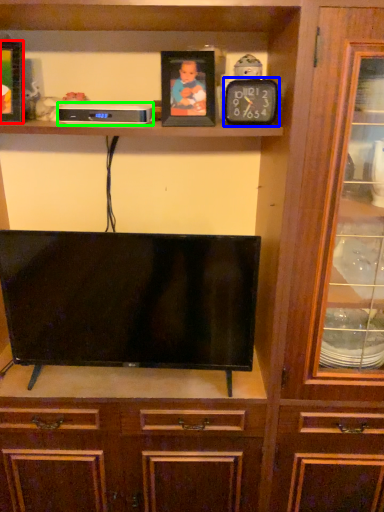
Question: Estimate the real-world distances between objects in this image. Which object is closer to picture frame (highlighted by a red box), clock (highlighted by a blue box) or appliance (highlighted by a green box)?

Choices:
 (A) clock
 (B) appliance

Answer: (B)